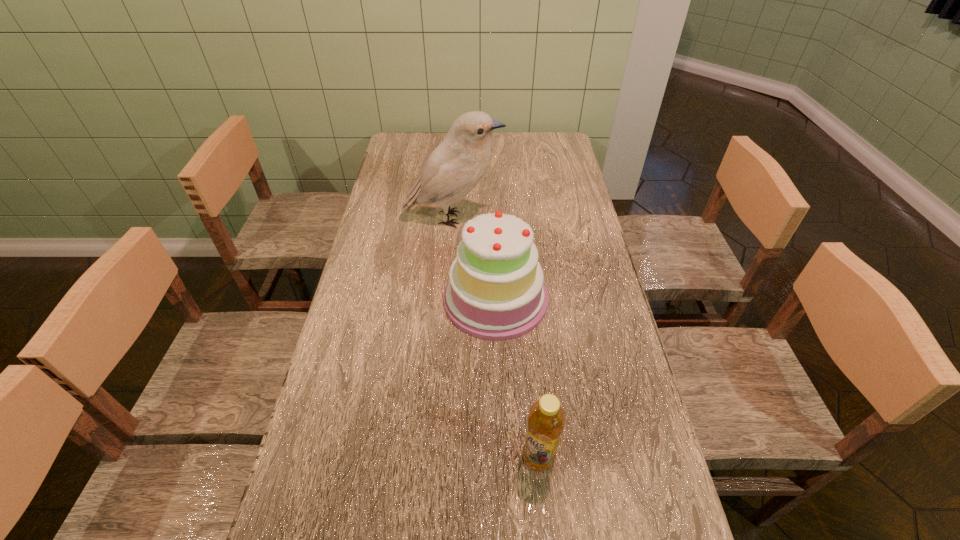
Image resolution: width=960 pixels, height=540 pixels. Identify the location of the farthest object. (458, 163).

I want to click on parakeet, so click(x=458, y=163).

Identify the location of cake. The height and width of the screenshot is (540, 960). (496, 292).

Locate an element on the screen. bottle is located at coordinates click(546, 419).

Locate an element on the screen. This screenshot has height=540, width=960. free spot located on the face of the farthest object is located at coordinates (532, 219).

Where is `free space located 0.280m on the back of the second nearest object`? Image resolution: width=960 pixels, height=540 pixels. free space located 0.280m on the back of the second nearest object is located at coordinates (492, 209).

Identify the location of free spot located on the right of the nearest object. The width and height of the screenshot is (960, 540). (616, 457).

Image resolution: width=960 pixels, height=540 pixels. What are the coordinates of `object present at the left edge` in the screenshot? It's located at (458, 163).

Identify the location of vacant region at the far edge. (440, 135).

In the image, there is a desktop. Identify the location of vacant region at the left edge. (323, 442).